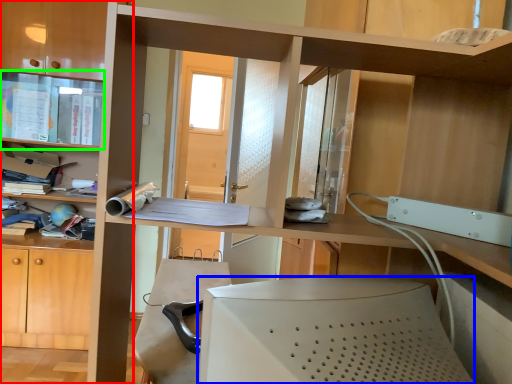
Question: Considering the real-world distances, which object is farthest from bookcase (highlighted by a red box)? desktop computer (highlighted by a blue box) or cabinet (highlighted by a green box)?

Choices:
 (A) desktop computer
 (B) cabinet

Answer: (A)